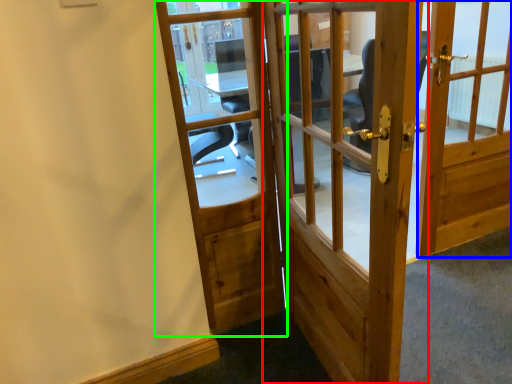
Question: Considering the real-world distances, which object is closest to door (highlighted by a red box)? door (highlighted by a blue box) or door (highlighted by a green box).

Choices:
 (A) door
 (B) door

Answer: (A)